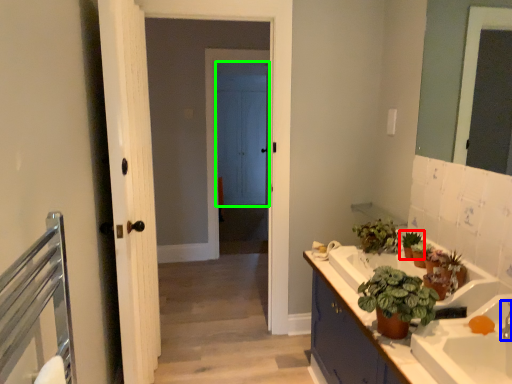
Question: Estimate the real-world distances between objects in this image. Which object is closer to houseplant (highlighted by a red box), faucet (highlighted by a blue box) or door (highlighted by a green box)?

Choices:
 (A) faucet
 (B) door

Answer: (A)